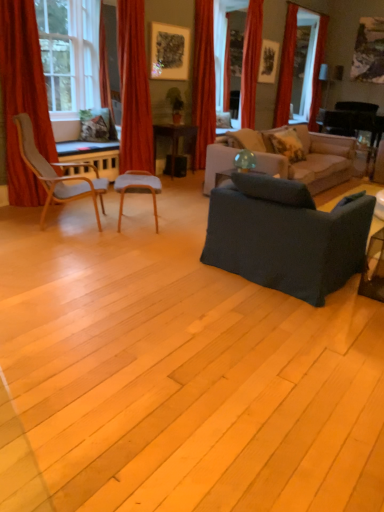
Where is `red velvet curtain at upper center, the fourth curtain in the left-to-right sequence`? red velvet curtain at upper center, the fourth curtain in the left-to-right sequence is located at coordinates (251, 62).

Describe the element at coordinates (175, 141) in the screenshot. I see `black glossy table at center` at that location.

This screenshot has height=512, width=384. Describe the element at coordinates (23, 98) in the screenshot. I see `red velvet curtain at left, arranged as the sixth curtain when viewed from the back` at that location.

The width and height of the screenshot is (384, 512). Describe the element at coordinates (318, 72) in the screenshot. I see `red velvet curtain at upper right, the first curtain from the right` at that location.

This screenshot has height=512, width=384. In order to click on red velvet curtain at upper right, the 1th curtain when ordered from back to front in this screenshot , I will do `click(318, 72)`.

Measure the distance between red velvet curtain at upper right, arranged as the fifth curtain when viewed from the front, and camera.

red velvet curtain at upper right, arranged as the fifth curtain when viewed from the front, is 6.32 meters away from camera.

Measure the distance between velvet red curtain at upper left, which ranks as the 2th curtain in front-to-back order, and camera.

velvet red curtain at upper left, which ranks as the 2th curtain in front-to-back order, and camera are 5.36 meters apart.

The image size is (384, 512). I want to click on red velvet curtain at upper center, which is counted as the 3th curtain, starting from the back, so click(x=251, y=62).

Does velvet red curtain at upper left, which is the fifth curtain from back to front, appear on the right side of red velvet curtain at upper center, positioned as the fourth curtain in front-to-back order?

No, velvet red curtain at upper left, which is the fifth curtain from back to front, is not to the right of red velvet curtain at upper center, positioned as the fourth curtain in front-to-back order.

From a real-world perspective, which object stands above the other?

red velvet curtain at upper center, which appears as the 3th curtain when viewed from the right, is physically above.

Between velvet red curtain at upper left, which ranks as the 2th curtain in front-to-back order, and red velvet curtain at upper center, positioned as the fourth curtain in front-to-back order, which one is positioned in front?

velvet red curtain at upper left, which ranks as the 2th curtain in front-to-back order, is in front.

Does velvet red curtain at upper left, which ranks as the second curtain in left-to-right order, have a lesser height compared to red velvet curtain at upper center, the fourth curtain in the left-to-right sequence?

Yes, velvet red curtain at upper left, which ranks as the second curtain in left-to-right order, is shorter than red velvet curtain at upper center, the fourth curtain in the left-to-right sequence.

The image size is (384, 512). Identify the location of the 1st studio couch positioned below the red velvet curtain at upper center, which appears as the 3th curtain when viewed from the right (from a real-world perspective). (286, 237).

Are dark gray fabric couch at center, the 1th studio couch from the front, and red velvet curtain at upper center, which appears as the 3th curtain when viewed from the right, making contact?

No, dark gray fabric couch at center, the 1th studio couch from the front, is not in contact with red velvet curtain at upper center, which appears as the 3th curtain when viewed from the right.

Can you confirm if dark gray fabric couch at center, positioned as the 2th studio couch in back-to-front order, is shorter than red velvet curtain at upper center, which is counted as the 3th curtain, starting from the back?

Correct, dark gray fabric couch at center, positioned as the 2th studio couch in back-to-front order, is not as tall as red velvet curtain at upper center, which is counted as the 3th curtain, starting from the back.

From a real-world perspective, between dark gray fabric couch at center, the 1th studio couch from the front, and red velvet curtain at upper center, which appears as the 3th curtain when viewed from the right, who is vertically lower?

dark gray fabric couch at center, the 1th studio couch from the front.

Which object is more forward, fluffy beige pillow at upper right or red velvet curtain at upper right, marked as the second curtain in a back-to-front arrangement?

fluffy beige pillow at upper right is more forward.

Is fluffy beige pillow at upper right at the right side of red velvet curtain at upper right, positioned as the second curtain in right-to-left order?

No, fluffy beige pillow at upper right is not to the right of red velvet curtain at upper right, positioned as the second curtain in right-to-left order.

From the fluffy beige pillow at upper right, count 1st curtain to the right and point to it. Please provide its 2D coordinates.

[(286, 68)]

Is fluffy beige pillow at upper right oriented towards red velvet curtain at upper right, marked as the second curtain in a back-to-front arrangement?

No, fluffy beige pillow at upper right is not facing towards red velvet curtain at upper right, marked as the second curtain in a back-to-front arrangement.

Relative to black glossy table at center, is matte gray chair at center, which is the first chair from right to left, in front or behind?

Clearly, matte gray chair at center, which is the first chair from right to left, is in front of black glossy table at center.

Considering the sizes of objects matte gray chair at center, the 2th chair from the left, and black glossy table at center in the image provided, who is smaller, matte gray chair at center, the 2th chair from the left, or black glossy table at center?

matte gray chair at center, the 2th chair from the left.

Considering the positions of points (152, 192) and (174, 163), is point (152, 192) farther from camera compared to point (174, 163)?

No, it is not.

Can you tell me how much matte gray chair at center, which is the first chair from right to left, and black glossy table at center differ in facing direction?

The facing directions of matte gray chair at center, which is the first chair from right to left, and black glossy table at center are 41.9 degrees apart.

Considering the sizes of objects red velvet curtain at upper center, which appears as the fourth curtain when viewed from the right, and matte gray chair at center, the 2th chair from the left, in the image provided, who is thinner, red velvet curtain at upper center, which appears as the fourth curtain when viewed from the right, or matte gray chair at center, the 2th chair from the left,?

With smaller width is red velvet curtain at upper center, which appears as the fourth curtain when viewed from the right.

From the red velvet curtain at upper center, which appears as the third curtain when viewed from the front, count 1st chairs forward and point to it. Please provide its 2D coordinates.

[(137, 189)]

Considering the relative sizes of red velvet curtain at upper center, the 3th curtain viewed from the left, and matte gray chair at center, which is the first chair from right to left, in the image provided, is red velvet curtain at upper center, the 3th curtain viewed from the left, bigger than matte gray chair at center, which is the first chair from right to left,?

Correct, red velvet curtain at upper center, the 3th curtain viewed from the left, is larger in size than matte gray chair at center, which is the first chair from right to left.

Are red velvet curtain at upper center, which appears as the fourth curtain when viewed from the right, and red velvet curtain at upper right, which is the sixth curtain from front to back, beside each other?

No.

Is red velvet curtain at upper center, which appears as the fourth curtain when viewed from the right, looking in the opposite direction of red velvet curtain at upper right, acting as the 6th curtain starting from the left?

No, red velvet curtain at upper center, which appears as the fourth curtain when viewed from the right, is not facing the opposite direction of red velvet curtain at upper right, acting as the 6th curtain starting from the left.

Does red velvet curtain at upper center, arranged as the fourth curtain when viewed from the back, have a smaller size compared to red velvet curtain at upper right, acting as the 6th curtain starting from the left?

Incorrect, red velvet curtain at upper center, arranged as the fourth curtain when viewed from the back, is not smaller in size than red velvet curtain at upper right, acting as the 6th curtain starting from the left.

In order to click on the 3rd curtain counting from the left of the red velvet curtain at upper right, acting as the 6th curtain starting from the left in this screenshot , I will do `click(203, 81)`.

Locate an element on the screen. The width and height of the screenshot is (384, 512). the 2nd chair in front of the red velvet curtain at upper center, which appears as the 3th curtain when viewed from the right is located at coordinates (58, 173).

Is red velvet curtain at upper center, the fourth curtain in the left-to-right sequence, smaller than light gray fabric chair at left, placed as the 2th chair when sorted from right to left?

Yes.

From a real-world perspective, who is located higher, red velvet curtain at upper center, which appears as the 3th curtain when viewed from the right, or light gray fabric chair at left, which ranks as the 1th chair in left-to-right order?

From a 3D spatial view, red velvet curtain at upper center, which appears as the 3th curtain when viewed from the right, is above.

Is red velvet curtain at upper center, which is counted as the 3th curtain, starting from the back, to the right of light gray fabric chair at left, which ranks as the 1th chair in left-to-right order, from the viewer's perspective?

Yes, red velvet curtain at upper center, which is counted as the 3th curtain, starting from the back, is to the right of light gray fabric chair at left, which ranks as the 1th chair in left-to-right order.

This screenshot has width=384, height=512. What are the coordinates of `the 2nd curtain located above the velvet red curtain at upper left, which ranks as the 2th curtain in front-to-back order (from a real-world perspective)` in the screenshot? It's located at (251, 62).

Identify the location of studio couch that is the 1st one below the red velvet curtain at upper center, positioned as the fourth curtain in front-to-back order (from a real-world perspective). This screenshot has width=384, height=512. (286, 237).

From the image, which object appears to be nearer to black glossy table at center, fluffy beige pillow at upper right or red velvet curtain at upper center, arranged as the fourth curtain when viewed from the back?

Among the two, red velvet curtain at upper center, arranged as the fourth curtain when viewed from the back, is located nearer to black glossy table at center.

Considering their positions, is suede beige couch at center, the 1th studio couch viewed from the back, positioned further to velvet red curtain at upper left, which ranks as the second curtain in left-to-right order, than red velvet curtain at left, which ranks as the first curtain in left-to-right order?

The object further to velvet red curtain at upper left, which ranks as the second curtain in left-to-right order, is suede beige couch at center, the 1th studio couch viewed from the back.

Estimate the real-world distances between objects in this image. Which object is closer to matte gray chair at center, which is the first chair from right to left, red velvet curtain at upper center, which appears as the third curtain when viewed from the front, or black glossy table at center?

The object closer to matte gray chair at center, which is the first chair from right to left, is black glossy table at center.

Which object lies further to the anchor point dark gray fabric couch at center, the 1th studio couch from the front, red velvet curtain at upper center, which appears as the 3th curtain when viewed from the right, or velvet red curtain at upper left, placed as the 5th curtain when sorted from right to left?

red velvet curtain at upper center, which appears as the 3th curtain when viewed from the right, lies further to dark gray fabric couch at center, the 1th studio couch from the front, than the other object.

Estimate the real-world distances between objects in this image. Which object is closer to dark gray fabric couch at center, positioned as the 2th studio couch in back-to-front order, velvet red curtain at upper left, which ranks as the 2th curtain in front-to-back order, or red velvet curtain at upper right, arranged as the fifth curtain when viewed from the front?

Among the two, velvet red curtain at upper left, which ranks as the 2th curtain in front-to-back order, is located nearer to dark gray fabric couch at center, positioned as the 2th studio couch in back-to-front order.

Estimate the real-world distances between objects in this image. Which object is closer to red velvet curtain at upper center, the fourth curtain in the left-to-right sequence, suede beige couch at center, arranged as the second studio couch when viewed from the front, or velvet red curtain at upper left, which ranks as the 2th curtain in front-to-back order?

suede beige couch at center, arranged as the second studio couch when viewed from the front, lies closer to red velvet curtain at upper center, the fourth curtain in the left-to-right sequence, than the other object.

From the image, which object appears to be farther from red velvet curtain at upper center, which appears as the third curtain when viewed from the front, red velvet curtain at left, placed as the 6th curtain when sorted from right to left, or velvet red curtain at upper left, which ranks as the 2th curtain in front-to-back order?

The object further to red velvet curtain at upper center, which appears as the third curtain when viewed from the front, is red velvet curtain at left, placed as the 6th curtain when sorted from right to left.

When comparing their distances from suede beige couch at center, the 1th studio couch viewed from the back, does red velvet curtain at upper center, which appears as the third curtain when viewed from the front, or red velvet curtain at upper right, placed as the fifth curtain when sorted from left to right, seem further?

red velvet curtain at upper center, which appears as the third curtain when viewed from the front, is positioned further to the anchor suede beige couch at center, the 1th studio couch viewed from the back.

Identify the location of chair between red velvet curtain at left, which ranks as the first curtain in left-to-right order, and matte gray chair at center, which is the first chair from right to left, from left to right. The width and height of the screenshot is (384, 512). (58, 173).

You are a GUI agent. You are given a task and a screenshot of the screen. Output one action in this format:
    pyautogui.click(x=<x>, y=<y>)
    Task: Click on the table between suede beige couch at center, arranged as the second studio couch when viewed from the front, and red velvet curtain at upper center, positioned as the fourth curtain in front-to-back order, along the z-axis
    Image resolution: width=384 pixels, height=512 pixels.
    Given the screenshot: What is the action you would take?
    pyautogui.click(x=175, y=141)

Find the location of a particular element. The image size is (384, 512). table located between fluffy beige pillow at upper right and red velvet curtain at upper right, placed as the fifth curtain when sorted from left to right, in the depth direction is located at coordinates [175, 141].

The image size is (384, 512). In order to click on table situated between red velvet curtain at left, arranged as the sixth curtain when viewed from the back, and fluffy beige pillow at upper right from left to right in this screenshot , I will do `click(175, 141)`.